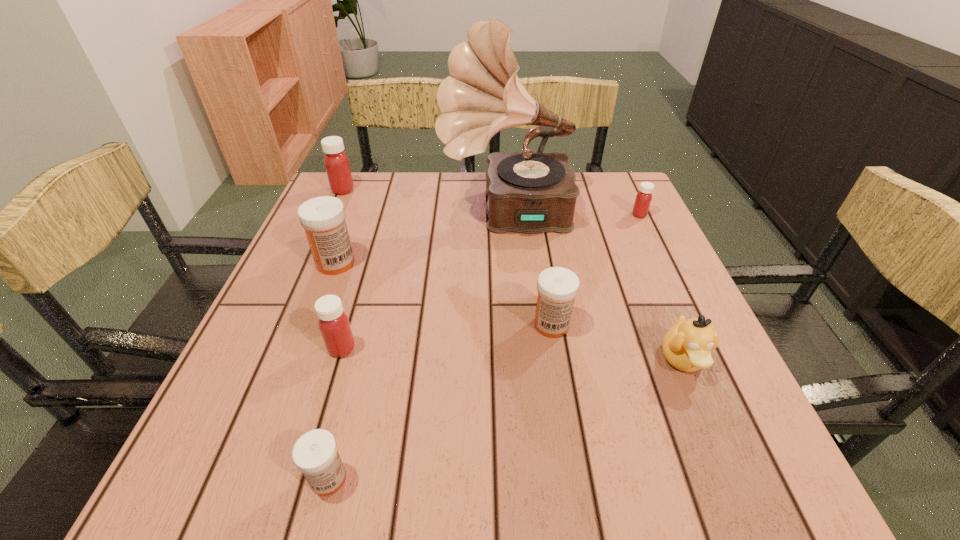
At what (x,y) coordinates should I click in order to perform the action: click on unoccupied area between the leftmost red medicine and the tan duckling. Please return your answer as a coordinate pair (x, y). The height and width of the screenshot is (540, 960). Looking at the image, I should click on (513, 275).

The width and height of the screenshot is (960, 540). What are the coordinates of `free space between the brown record player and the second farthest white medicine` in the screenshot? It's located at (529, 269).

Find the location of a particular element. The height and width of the screenshot is (540, 960). empty location between the second white medicine from right to left and the second red medicine from left to right is located at coordinates (335, 413).

Identify the location of free area in between the second white medicine from left to right and the second farthest white medicine. (440, 402).

The image size is (960, 540). In order to click on object that ranks as the fifth closest to the second farthest white medicine in this screenshot , I will do `click(643, 199)`.

The image size is (960, 540). Find the location of `the second closest object to the fifth nearest medicine`. the second closest object to the fifth nearest medicine is located at coordinates (557, 287).

Select which medicine appears as the fourth closest to the second red medicine from left to right. Please provide its 2D coordinates. Your answer should be formatted as a tuple, i.e. [(x, y)], where the tuple contains the x and y coordinates of a point satisfying the conditions above.

[(336, 162)]

Select which medicine appears as the fifth closest to the farthest red medicine. Please provide its 2D coordinates. Your answer should be formatted as a tuple, i.e. [(x, y)], where the tuple contains the x and y coordinates of a point satisfying the conditions above.

[(315, 454)]

What are the coordinates of `red medicine identified as the third closest to the duckling` in the screenshot? It's located at click(x=336, y=162).

Identify which red medicine is located as the second nearest to the second farthest medicine. Please provide its 2D coordinates. Your answer should be formatted as a tuple, i.e. [(x, y)], where the tuple contains the x and y coordinates of a point satisfying the conditions above.

[(336, 162)]